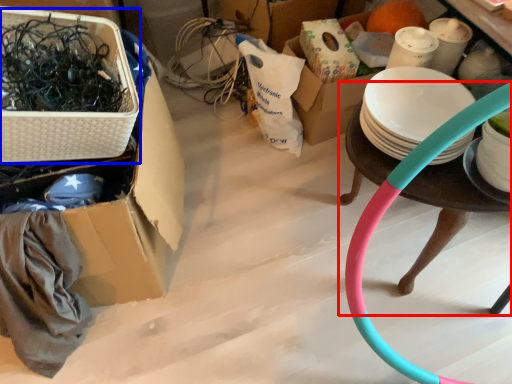
Question: Which object appears closest to the camera in this image, table (highlighted by a red box) or basket (highlighted by a blue box)?

Choices:
 (A) table
 (B) basket

Answer: (B)